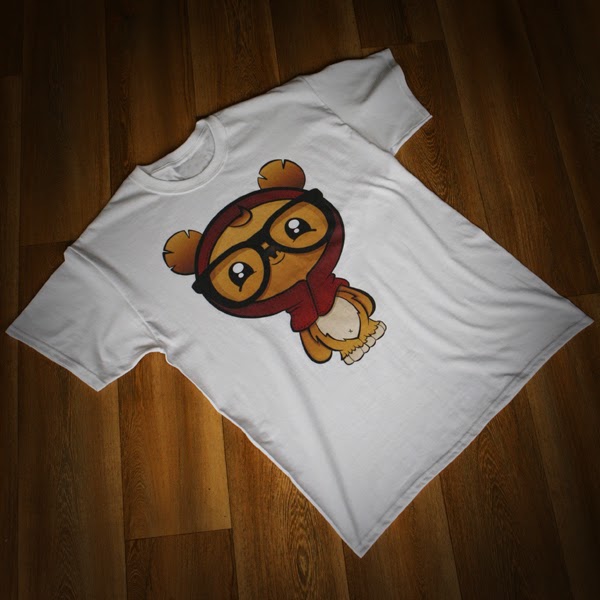
Where is `floor`? Image resolution: width=600 pixels, height=600 pixels. floor is located at coordinates (186, 489).